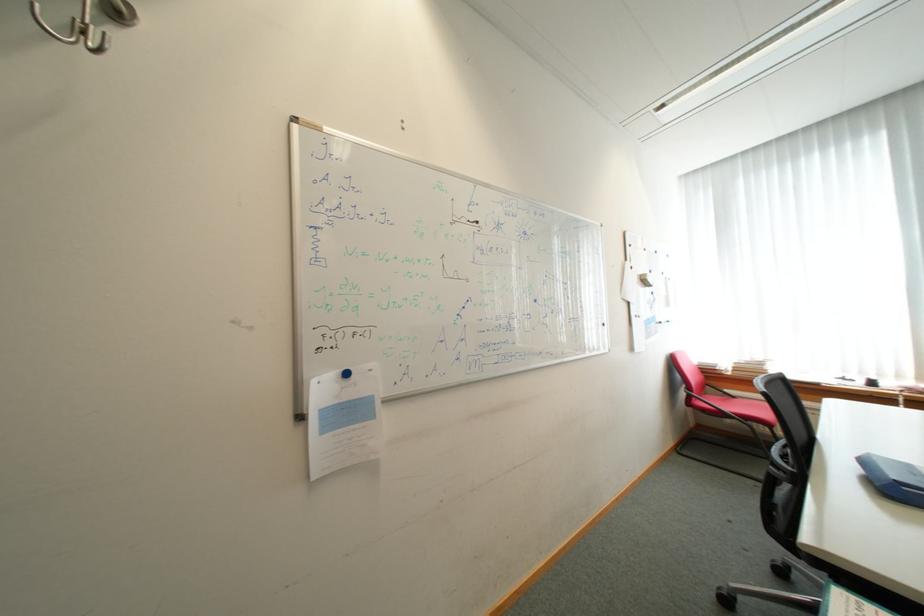
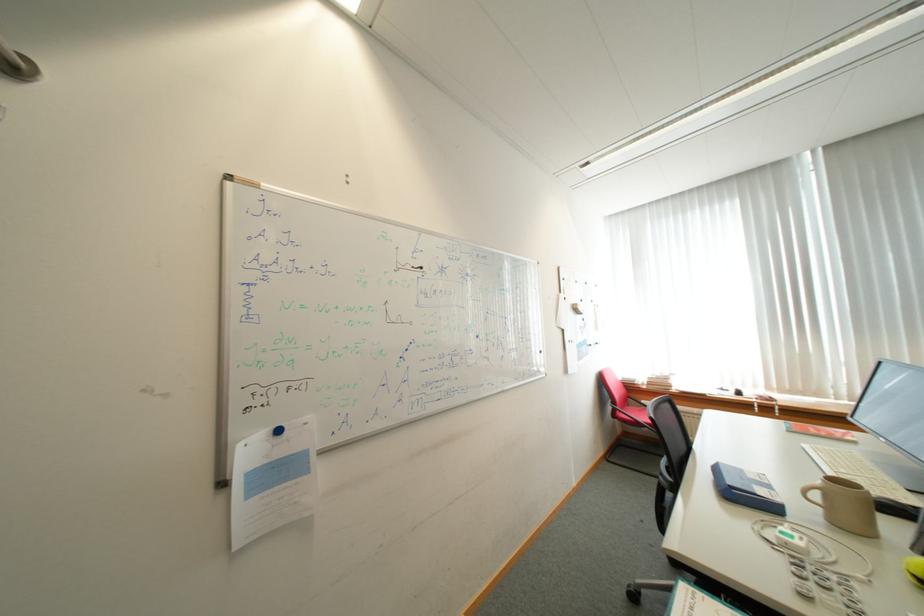
In a continuous first-person perspective shot, in which direction is the camera moving?

The movement direction of the cameraman is right, backward.